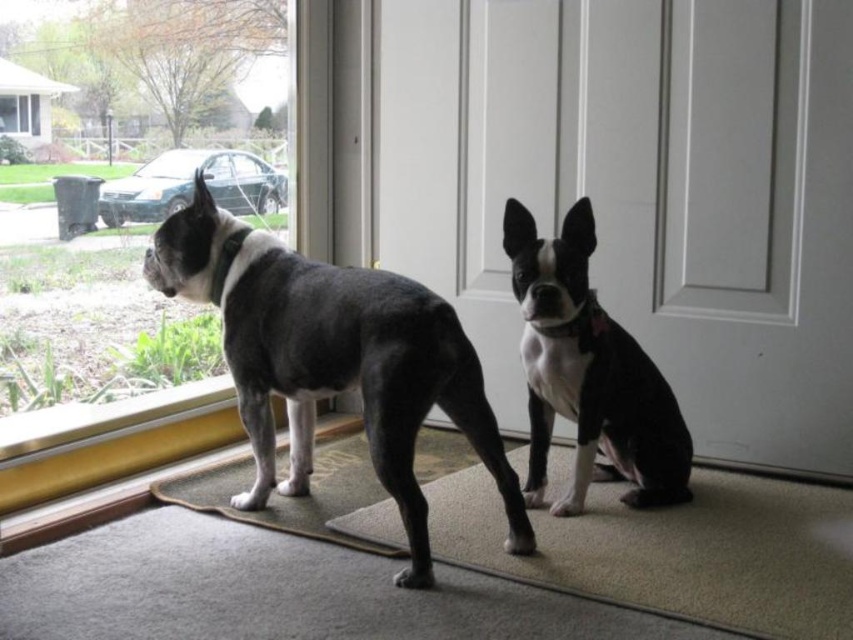
Question: Which point is closer to the camera?

Choices:
 (A) carpeted mat at lower center
 (B) carpet at lower center
 (C) transparent glass window at upper left
 (D) white glossy door at center

Answer: (B)

Question: Which point appears farthest from the camera in this image?

Choices:
 (A) (30, 113)
 (B) (312, 538)
 (C) (709, 560)

Answer: (A)

Question: Does white glossy door at center lie in front of black and white fur dog at left?

Choices:
 (A) no
 (B) yes

Answer: (A)

Question: Which of the following is the farthest from the observer?

Choices:
 (A) (730, 394)
 (B) (363, 292)
 (C) (32, 131)
 (D) (233, 477)

Answer: (D)

Question: Observing the image, what is the correct spatial positioning of black and white fur dog at left in reference to carpet at lower center?

Choices:
 (A) left
 (B) right

Answer: (A)

Question: In this image, where is white glossy door at center located relative to carpet at lower center?

Choices:
 (A) below
 (B) above

Answer: (B)